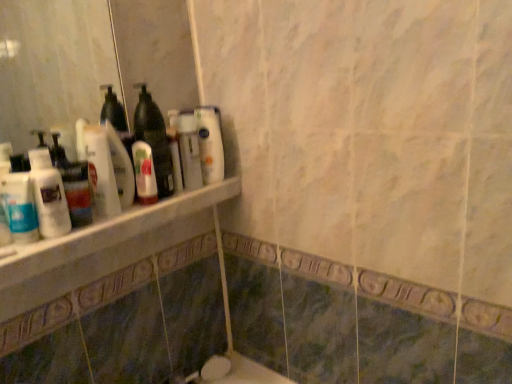
Question: Should I look upward or downward to see white marble ledge at upper left?

Choices:
 (A) up
 (B) down

Answer: (B)

Question: Is translucent plastic bottle at left, the 1th cleaning product viewed from the left, bigger than white glossy mouthwash at left, placed as the 1th mouthwash when sorted from left to right?

Choices:
 (A) no
 (B) yes

Answer: (B)

Question: Is translucent plastic bottle at left, acting as the 3th cleaning product starting from the right, oriented away from white glossy mouthwash at left, which is the second mouthwash in back-to-front order?

Choices:
 (A) yes
 (B) no

Answer: (B)

Question: Is translucent plastic bottle at left, which is the first cleaning product from front to back, not close to white glossy mouthwash at left, placed as the 1th mouthwash when sorted from left to right?

Choices:
 (A) no
 (B) yes

Answer: (A)

Question: From a real-world perspective, is translucent plastic bottle at left, which is the first cleaning product from front to back, under white glossy mouthwash at left, which is the second mouthwash in back-to-front order?

Choices:
 (A) no
 (B) yes

Answer: (A)

Question: Does translucent plastic bottle at left, which is the first cleaning product from front to back, have a smaller size compared to white glossy mouthwash at left, positioned as the 2th mouthwash in right-to-left order?

Choices:
 (A) yes
 (B) no

Answer: (B)

Question: Is white glossy mouthwash at left, the first mouthwash from the front, located within translucent plastic bottle at left, the 1th cleaning product viewed from the left?

Choices:
 (A) no
 (B) yes

Answer: (A)

Question: From a real-world perspective, is translucent plastic mouthwash at shelf center, the 1th mouthwash in the right-to-left sequence, positioned under white glossy bottles at upper left based on gravity?

Choices:
 (A) yes
 (B) no

Answer: (A)

Question: Is white glossy bottles at upper left inside translucent plastic mouthwash at shelf center, the 1th mouthwash in the right-to-left sequence?

Choices:
 (A) no
 (B) yes

Answer: (A)

Question: Does translucent plastic mouthwash at shelf center, the 2th mouthwash in the front-to-back sequence, appear on the right side of white glossy bottles at upper left?

Choices:
 (A) no
 (B) yes

Answer: (B)

Question: Does translucent plastic mouthwash at shelf center, the 1th mouthwash in the right-to-left sequence, have a lesser height compared to white glossy bottles at upper left?

Choices:
 (A) yes
 (B) no

Answer: (A)

Question: Considering the relative positions of translucent plastic mouthwash at shelf center, which appears as the second mouthwash when viewed from the left, and white glossy bottles at upper left in the image provided, is translucent plastic mouthwash at shelf center, which appears as the second mouthwash when viewed from the left, in front of white glossy bottles at upper left?

Choices:
 (A) yes
 (B) no

Answer: (B)

Question: Are translucent plastic mouthwash at shelf center, the 1th mouthwash in the right-to-left sequence, and white glossy bottles at upper left making contact?

Choices:
 (A) yes
 (B) no

Answer: (B)

Question: Does white marble ledge at upper left have a smaller size compared to translucent plastic bottle at center?

Choices:
 (A) no
 (B) yes

Answer: (A)